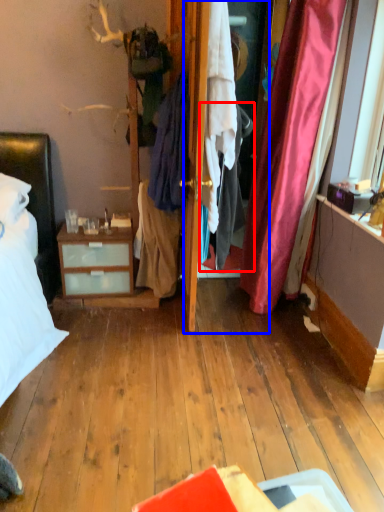
Question: Which object appears farthest to the camera in this image, clothing (highlighted by a red box) or screen door (highlighted by a blue box)?

Choices:
 (A) clothing
 (B) screen door

Answer: (B)